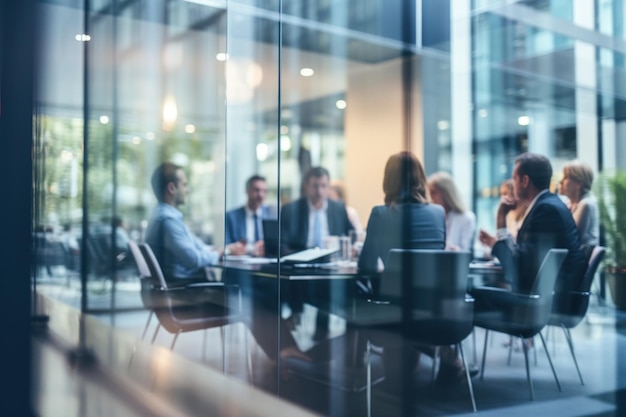
Identify the location of conference room chairs. The height and width of the screenshot is (417, 626). (160, 280), (429, 285), (548, 278), (586, 296).